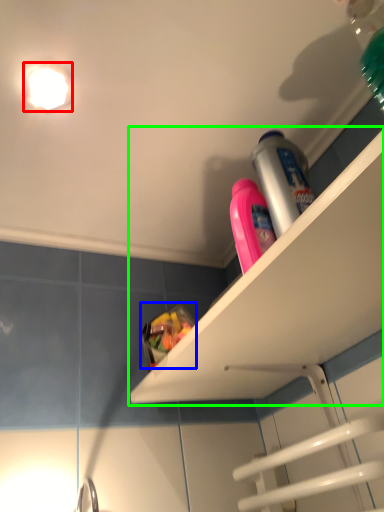
Question: Estimate the real-world distances between objects in this image. Which object is closer to light fixture (highlighted by a red box), food (highlighted by a blue box) or shelf (highlighted by a green box)?

Choices:
 (A) food
 (B) shelf

Answer: (A)